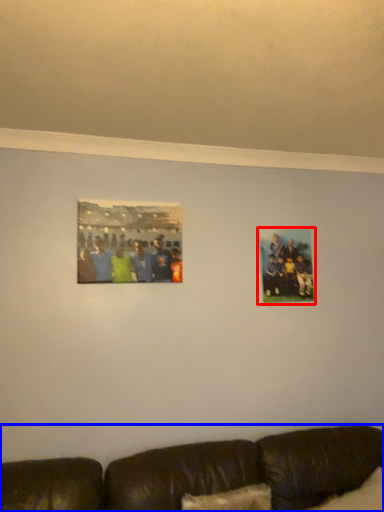
Question: Which object appears farthest to the camera in this image, picture frame (highlighted by a red box) or studio couch (highlighted by a blue box)?

Choices:
 (A) picture frame
 (B) studio couch

Answer: (A)